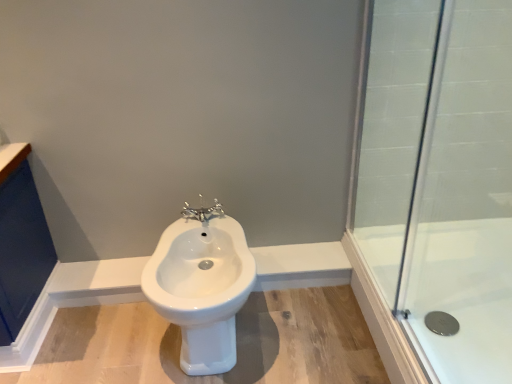
Question: From the image's perspective, is white glossy bidet at center located beneath clear glass shower at right?

Choices:
 (A) yes
 (B) no

Answer: (B)

Question: Considering the relative positions of white glossy bidet at center and clear glass shower at right in the image provided, is white glossy bidet at center to the right of clear glass shower at right from the viewer's perspective?

Choices:
 (A) yes
 (B) no

Answer: (B)

Question: Is white glossy bidet at center aimed at clear glass shower at right?

Choices:
 (A) no
 (B) yes

Answer: (A)

Question: From a real-world perspective, is white glossy bidet at center positioned under clear glass shower at right based on gravity?

Choices:
 (A) no
 (B) yes

Answer: (A)

Question: Is clear glass shower at right at the back of white glossy bidet at center?

Choices:
 (A) yes
 (B) no

Answer: (B)

Question: Is chrome metallic faucet at center in front of or behind transparent glass shower door at right in the image?

Choices:
 (A) front
 (B) behind

Answer: (B)

Question: Is chrome metallic faucet at center inside or outside of transparent glass shower door at right?

Choices:
 (A) inside
 (B) outside

Answer: (B)

Question: Based on their sizes in the image, would you say chrome metallic faucet at center is bigger or smaller than transparent glass shower door at right?

Choices:
 (A) small
 (B) big

Answer: (A)

Question: Does point (202, 211) appear closer or farther from the camera than point (479, 213)?

Choices:
 (A) farther
 (B) closer

Answer: (B)

Question: Would you say clear glass shower at right is to the left or to the right of transparent glass shower door at right in the picture?

Choices:
 (A) left
 (B) right

Answer: (B)

Question: In terms of size, does clear glass shower at right appear bigger or smaller than transparent glass shower door at right?

Choices:
 (A) small
 (B) big

Answer: (B)

Question: Is clear glass shower at right spatially inside transparent glass shower door at right, or outside of it?

Choices:
 (A) inside
 (B) outside

Answer: (B)

Question: From the image's perspective, relative to transparent glass shower door at right, is clear glass shower at right above or below?

Choices:
 (A) above
 (B) below

Answer: (B)

Question: Considering the relative positions of clear glass shower at right and white glossy bidet at center in the image provided, is clear glass shower at right to the left or to the right of white glossy bidet at center?

Choices:
 (A) left
 (B) right

Answer: (B)

Question: Is clear glass shower at right in front of or behind white glossy bidet at center in the image?

Choices:
 (A) front
 (B) behind

Answer: (B)